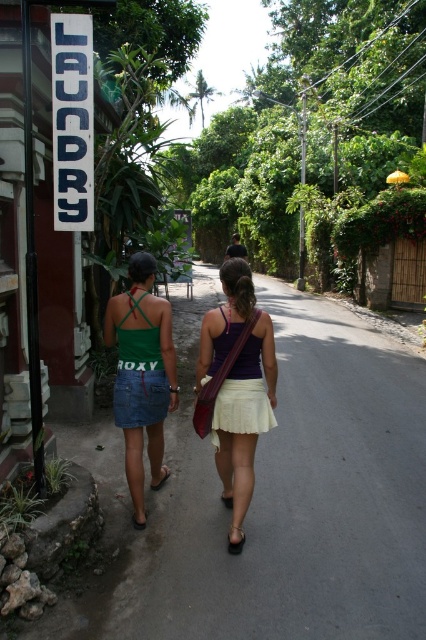
Question: Does matte purple tank top at center have a lesser width compared to green denim skirt at center?

Choices:
 (A) no
 (B) yes

Answer: (A)

Question: Observing the image, what is the correct spatial positioning of matte purple tank top at center in reference to green denim skirt at center?

Choices:
 (A) below
 (B) above

Answer: (A)

Question: Can you confirm if matte purple tank top at center is positioned to the left of green denim skirt at center?

Choices:
 (A) yes
 (B) no

Answer: (B)

Question: Among these objects, which one is nearest to the camera?

Choices:
 (A) green denim skirt at center
 (B) matte purple tank top at center

Answer: (B)

Question: Among these objects, which one is nearest to the camera?

Choices:
 (A) green denim skirt at center
 (B) matte purple tank top at center

Answer: (B)